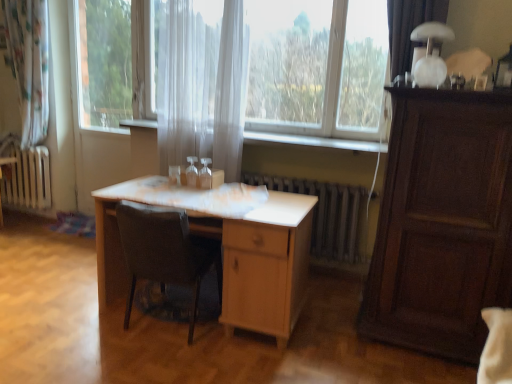
Image resolution: width=512 pixels, height=384 pixels. Identify the location of vacant area on top of light wood table at center (from a real-world perspective). (202, 193).